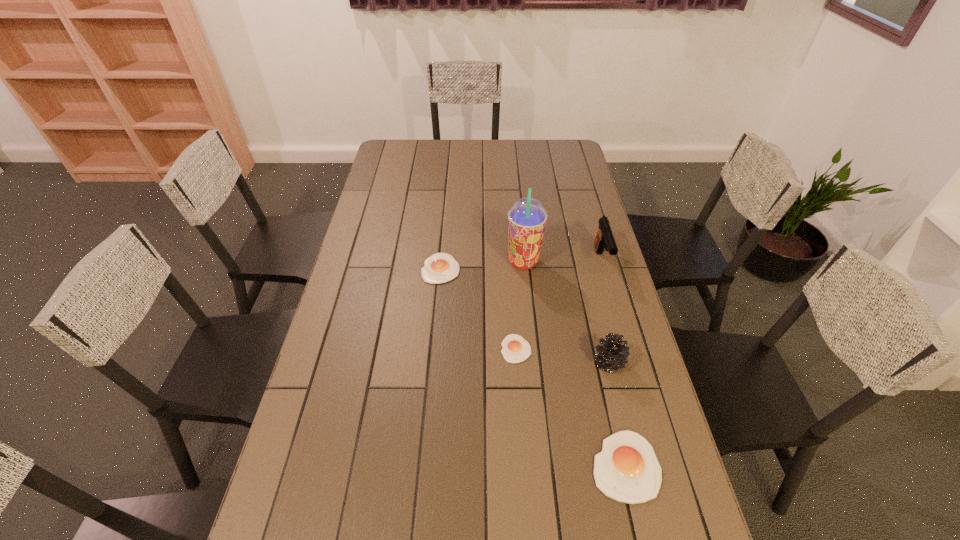
You are a GUI agent. You are given a task and a screenshot of the screen. Output one action in this format:
    pyautogui.click(x=<x>, y=<y>)
    Task: Click on the vacant area situated 0.390m on the front of the second nearest egg yolk
    
    Given the screenshot: What is the action you would take?
    pyautogui.click(x=528, y=516)

Image resolution: width=960 pixels, height=540 pixels. Find the location of `vacant space positioned on the back of the nearest egg yolk`. vacant space positioned on the back of the nearest egg yolk is located at coordinates (596, 337).

Where is `free space located on the back of the smoothie`? This screenshot has width=960, height=540. free space located on the back of the smoothie is located at coordinates (519, 219).

I want to click on vacant space situated 0.230m on the left of the third tallest object, so click(511, 363).

Identify the location of vacant space positioned at the barrel of the fifth shortest object. The image size is (960, 540). (619, 324).

Locate an element on the screen. Image resolution: width=960 pixels, height=540 pixels. object that is at the near edge is located at coordinates (627, 470).

This screenshot has width=960, height=540. I want to click on egg yolk present at the right edge, so click(x=627, y=470).

The height and width of the screenshot is (540, 960). Identify the location of pinecone positioned at the right edge. (613, 353).

Where is `pistol that is at the right edge`? pistol that is at the right edge is located at coordinates (604, 238).

This screenshot has width=960, height=540. In order to click on object present at the near right corner in this screenshot , I will do `click(627, 470)`.